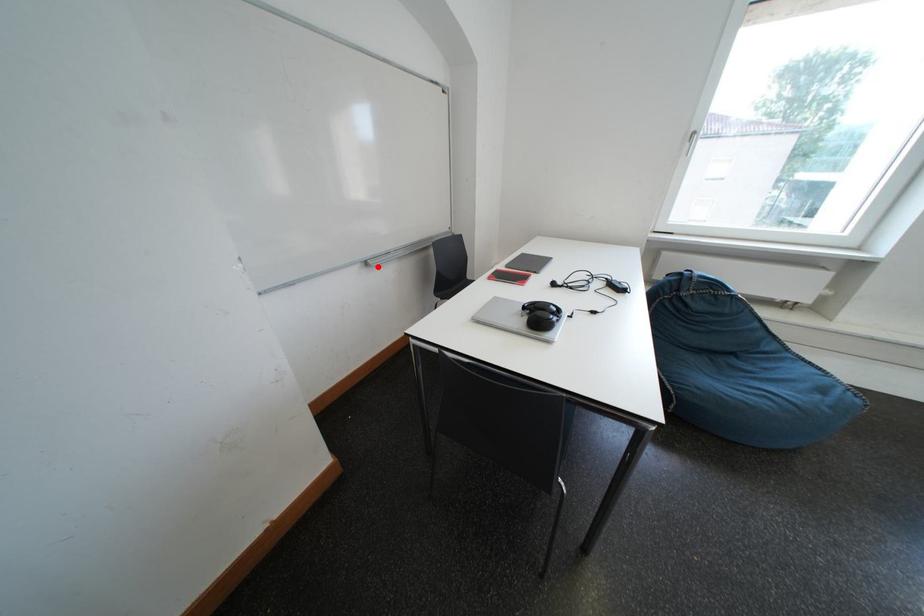
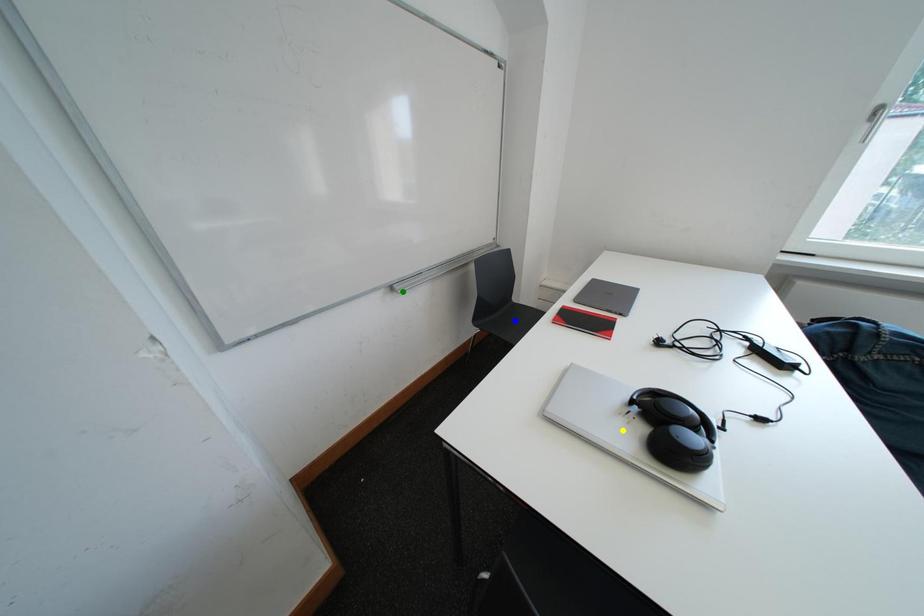
Question: I am providing you with two images of the same scene from different viewpoints. A red point is marked on the first image. You are given multiple points on the second image. Which point in image 2 is actually the same real-world point as the red point in image 1?

Choices:
 (A) yellow point
 (B) blue point
 (C) green point

Answer: (C)